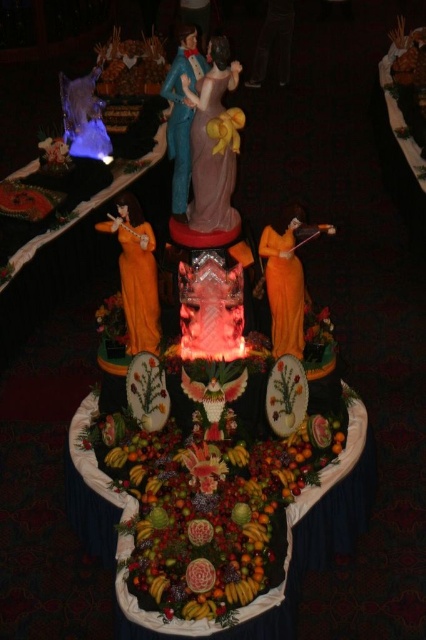
You are a fashion designer observing the festive centerpiece and notice two garments displayed there. The orange fabric dress at center and the black jeans at center. Which garment has a shorter length?

The orange fabric dress at center is shorter than the black jeans at center, so the orange fabric dress at center has a shorter length.

You are a guest at a party and want to take a photo of the pink satin statue at center and the matte blue fabric at center. Which object should you focus on first to ensure both are in the frame?

You should focus on the pink satin statue at center first because it is closer to you than the matte blue fabric at center, so adjusting the focus starting from it will help capture both in the frame.

You are a guest at a party and want to take a photo of the pink satin statue at center and the matte blue fabric at center. Which object should you focus on first if you want to capture both in one frame without moving the camera?

You should focus on the pink satin statue at center first because it is to the right of the matte blue fabric at center, so positioning the camera to include both would require framing from the right side to the left side.